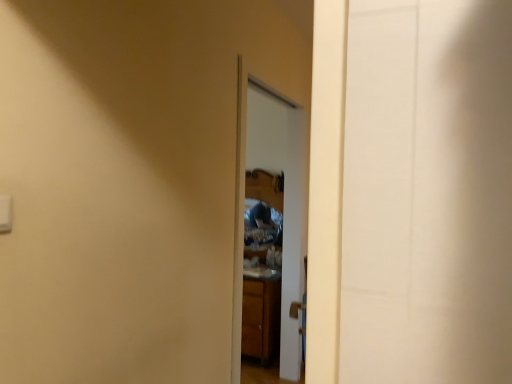
Question: Looking at the image, does white plastic light switch at upper left seem bigger or smaller compared to glossy wooden mirror at center?

Choices:
 (A) big
 (B) small

Answer: (B)

Question: Looking at their shapes, would you say white plastic light switch at upper left is wider or thinner than glossy wooden mirror at center?

Choices:
 (A) wide
 (B) thin

Answer: (B)

Question: Which of these objects is positioned closest to the glossy wooden mirror at center?

Choices:
 (A) white plastic light switch at upper left
 (B) wooden cabinet at center

Answer: (B)

Question: Which is nearer to the glossy wooden mirror at center?

Choices:
 (A) white plastic light switch at upper left
 (B) wooden cabinet at center

Answer: (B)